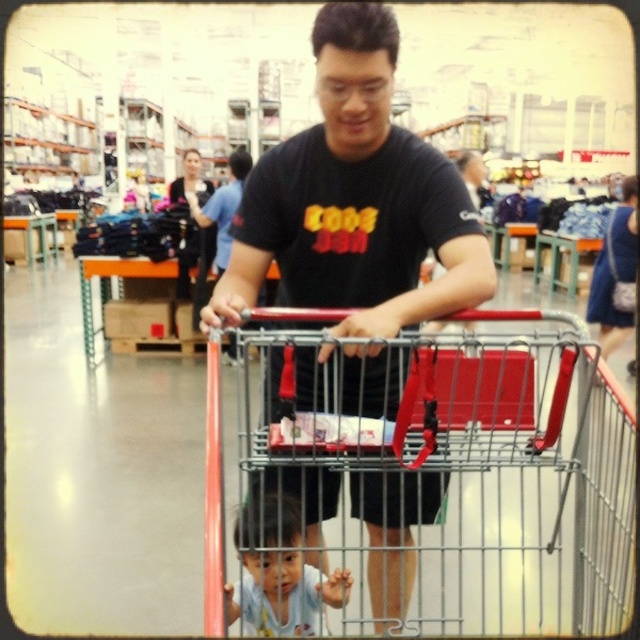
Question: Observing the image, what is the correct spatial positioning of metallic silver shopping cart at center in reference to black matte t-shirt at center?

Choices:
 (A) below
 (B) above

Answer: (A)

Question: Which point is closer to the camera?

Choices:
 (A) (310, 620)
 (B) (573, 609)
 (C) (340, 406)

Answer: (B)

Question: Which point appears farthest from the camera in this image?

Choices:
 (A) (253, 310)
 (B) (275, 554)

Answer: (B)

Question: Observing the image, what is the correct spatial positioning of black matte t-shirt at center in reference to light blue fabric baby at lower center?

Choices:
 (A) left
 (B) right

Answer: (B)

Question: Which of these objects is positioned closest to the light blue fabric baby at lower center?

Choices:
 (A) metallic silver shopping cart at center
 (B) black matte t-shirt at center

Answer: (B)

Question: Considering the relative positions of black matte t-shirt at center and light blue fabric baby at lower center in the image provided, where is black matte t-shirt at center located with respect to light blue fabric baby at lower center?

Choices:
 (A) right
 (B) left

Answer: (A)